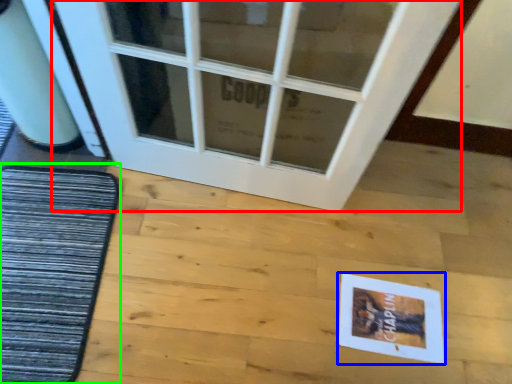
Question: Which is nearer to the door (highlighted by a red box)? postcard (highlighted by a blue box) or mat (highlighted by a green box).

Choices:
 (A) postcard
 (B) mat

Answer: (B)